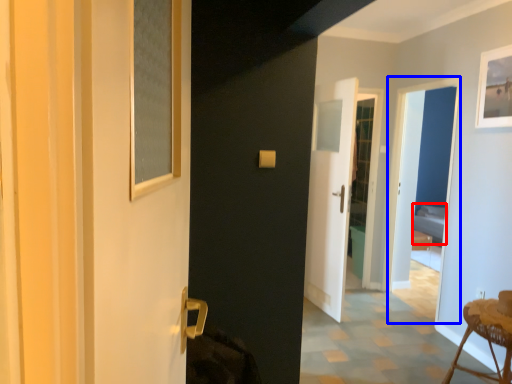
Question: Which object appears closest to the camera in this image, bed (highlighted by a red box) or screen door (highlighted by a blue box)?

Choices:
 (A) bed
 (B) screen door

Answer: (B)